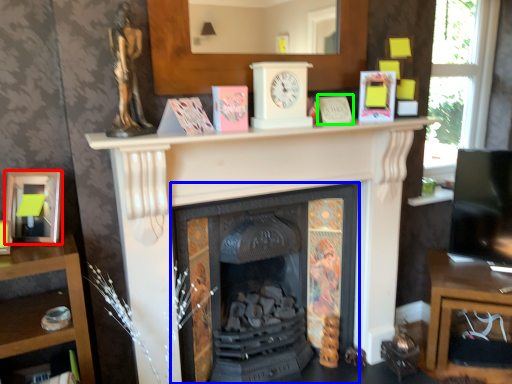
Question: Based on their relative distances, which object is farther from picture frame (highlighted by a red box)? Choose from fireplace (highlighted by a blue box) and paperback book (highlighted by a green box).

Choices:
 (A) fireplace
 (B) paperback book

Answer: (B)